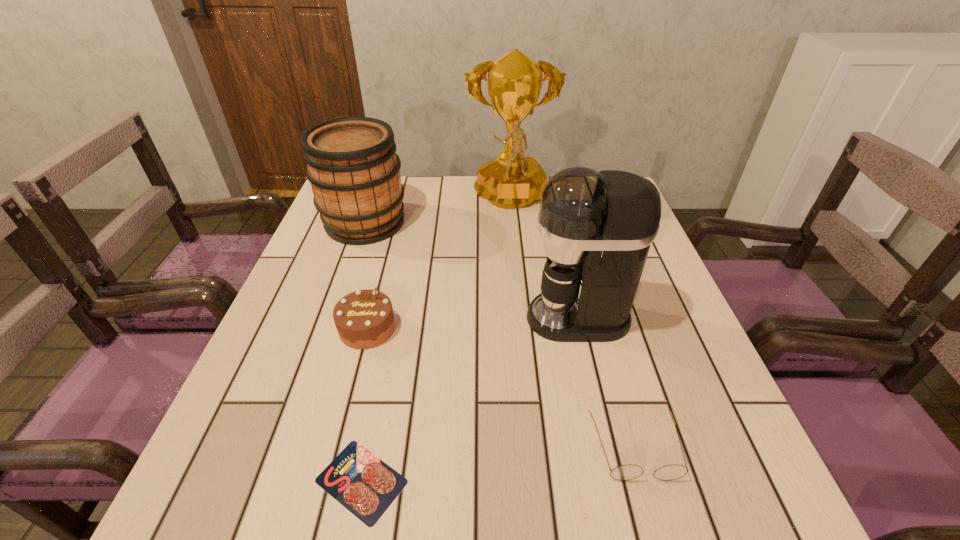
Locate an element on the screen. The image size is (960, 540). spectacles that is positioned at the right edge is located at coordinates (624, 472).

Image resolution: width=960 pixels, height=540 pixels. Find the location of `object situated at the far left corner`. object situated at the far left corner is located at coordinates (352, 166).

This screenshot has height=540, width=960. What are the coordinates of `object situated at the near right corner` in the screenshot? It's located at (624, 472).

In the image, there is a desktop. At what (x,y) coordinates should I click in order to perform the action: click on vacant space at the far edge. Please return your answer as a coordinate pair (x, y). Looking at the image, I should click on (479, 210).

I want to click on blank space at the near edge, so click(x=321, y=513).

Where is `vacant region at the left edge of the desktop`? The image size is (960, 540). vacant region at the left edge of the desktop is located at coordinates (301, 279).

In the image, there is a desktop. Where is `free region at the right edge`? This screenshot has width=960, height=540. free region at the right edge is located at coordinates (666, 397).

Locate an element on the screen. vacant point at the near left corner is located at coordinates (256, 480).

The height and width of the screenshot is (540, 960). In the image, there is a desktop. Find the location of `vacant space at the near right corner`. vacant space at the near right corner is located at coordinates (706, 523).

You are a GUI agent. You are given a task and a screenshot of the screen. Output one action in this format:
    pyautogui.click(x=<x>, y=<y>)
    Task: Click on the free area in between the cider and the shortest object
    The image size is (960, 540).
    Given the screenshot: What is the action you would take?
    pyautogui.click(x=363, y=352)